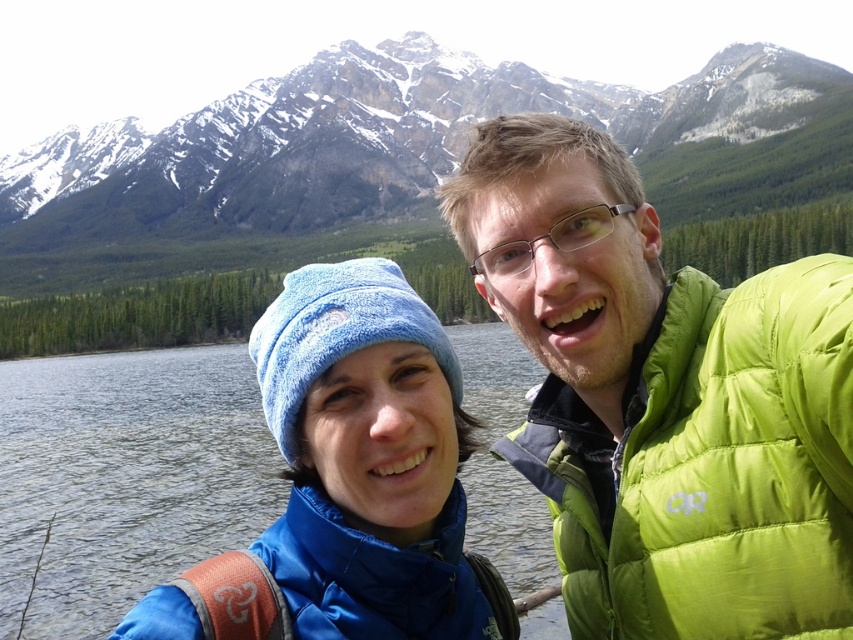
Find the location of a particular element. Image resolution: width=853 pixels, height=640 pixels. snowy rock mountain at upper center is located at coordinates (370, 134).

What are the coordinates of `snowy rock mountain at upper center` in the screenshot? It's located at (370, 134).

Between lime green puffer jacket at upper right and blue synthetic down jacket at lower left, which one has more height?

With more height is lime green puffer jacket at upper right.

Does point (810, 284) come closer to viewer compared to point (347, 556)?

Yes.

Is point (675, 396) positioned behind point (489, 630)?

No, (675, 396) is in front of (489, 630).

Image resolution: width=853 pixels, height=640 pixels. In order to click on lime green puffer jacket at upper right in this screenshot , I will do `click(664, 397)`.

Is point (577, 506) more distant than point (317, 58)?

That is False.

Identify the location of lime green puffer jacket at upper right. This screenshot has height=640, width=853. tap(664, 397).

Locate an element on the screen. lime green puffer jacket at upper right is located at coordinates (664, 397).